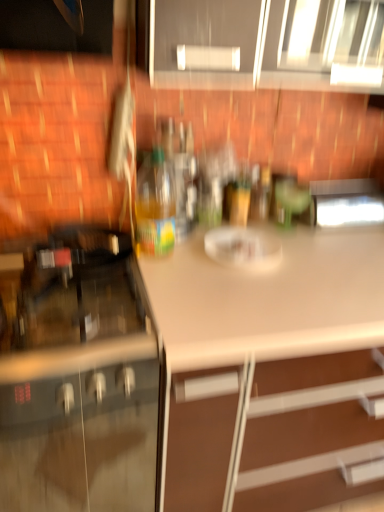
Question: From the image's perspective, is translucent plastic bottle at center under white matte countertop at center?

Choices:
 (A) no
 (B) yes

Answer: (A)

Question: Is translucent plastic bottle at center outside of white matte countertop at center?

Choices:
 (A) yes
 (B) no

Answer: (A)

Question: Can you confirm if translucent plastic bottle at center is thinner than white matte countertop at center?

Choices:
 (A) yes
 (B) no

Answer: (A)

Question: Is the position of translucent plastic bottle at center less distant than that of white matte countertop at center?

Choices:
 (A) no
 (B) yes

Answer: (A)

Question: From a real-world perspective, is translucent plastic bottle at center on white matte countertop at center?

Choices:
 (A) no
 (B) yes

Answer: (B)

Question: Considering their positions, is metallic stainless steel microwave at upper right located in front of or behind translucent plastic bottle at center?

Choices:
 (A) behind
 (B) front

Answer: (A)

Question: From a real-world perspective, is metallic stainless steel microwave at upper right physically located above or below translucent plastic bottle at center?

Choices:
 (A) below
 (B) above

Answer: (A)

Question: Which is correct: metallic stainless steel microwave at upper right is inside translucent plastic bottle at center, or outside of it?

Choices:
 (A) inside
 (B) outside

Answer: (B)

Question: Is metallic stainless steel microwave at upper right taller or shorter than translucent plastic bottle at center?

Choices:
 (A) tall
 (B) short

Answer: (B)

Question: Is matte black oven at left, acting as the 1th cabinetry starting from the bottom, bigger or smaller than matte gray cabinets at upper center, which appears as the 1th cabinetry when viewed from the right?

Choices:
 (A) big
 (B) small

Answer: (A)

Question: Choose the correct answer: Is matte black oven at left, the second cabinetry when ordered from right to left, inside matte gray cabinets at upper center, which appears as the 1th cabinetry when viewed from the right, or outside it?

Choices:
 (A) outside
 (B) inside

Answer: (A)

Question: Is matte black oven at left, the second cabinetry when ordered from top to bottom, taller or shorter than matte gray cabinets at upper center, which appears as the 1th cabinetry when viewed from the right?

Choices:
 (A) short
 (B) tall

Answer: (B)

Question: In the image, is matte black oven at left, the second cabinetry when ordered from top to bottom, on the left side or the right side of matte gray cabinets at upper center, which appears as the 1th cabinetry when viewed from the right?

Choices:
 (A) left
 (B) right

Answer: (A)

Question: Does point (56, 264) appear closer or farther from the camera than point (145, 246)?

Choices:
 (A) farther
 (B) closer

Answer: (B)

Question: Considering the positions of matte black oven at left, acting as the 1th cabinetry starting from the bottom, and translucent plastic bottle at center in the image, is matte black oven at left, acting as the 1th cabinetry starting from the bottom, taller or shorter than translucent plastic bottle at center?

Choices:
 (A) tall
 (B) short

Answer: (A)